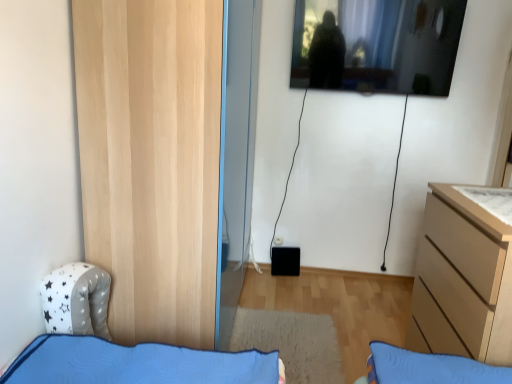
Question: Does point (448, 264) appear closer or farther from the camera than point (420, 8)?

Choices:
 (A) farther
 (B) closer

Answer: (B)

Question: Is light wood chest of drawers at right wider or thinner than transparent glass window at upper center?

Choices:
 (A) wide
 (B) thin

Answer: (A)

Question: Which of these objects is positioned closest to the natural wood door at left?

Choices:
 (A) light wood chest of drawers at right
 (B) white matte drawer at upper right
 (C) transparent glass window at upper center

Answer: (A)

Question: Which of these objects is positioned closest to the natural wood door at left?

Choices:
 (A) light wood chest of drawers at right
 (B) white matte drawer at upper right
 (C) transparent glass window at upper center

Answer: (A)